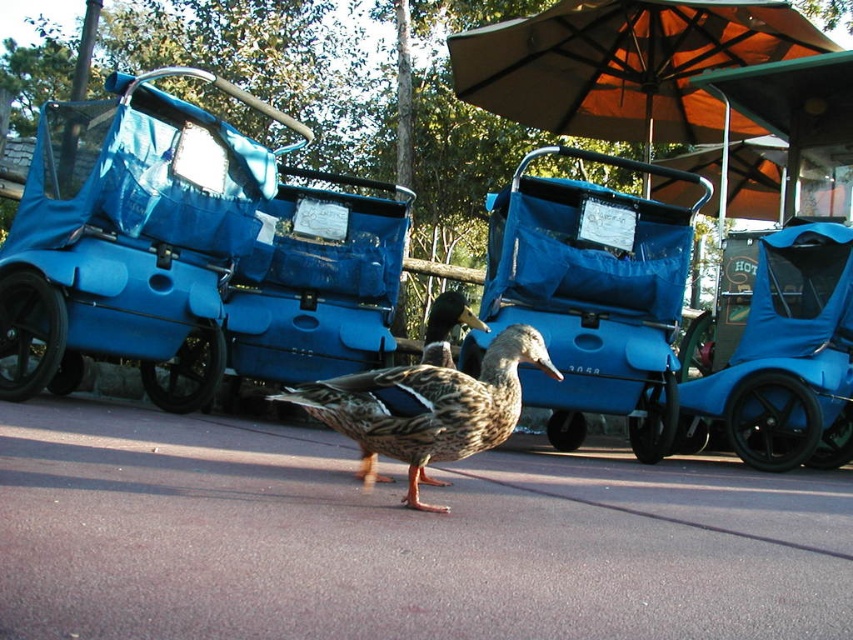
From the picture: You are a photographer trying to capture both the blue matte golf cart at center and the brown fabric umbrella at upper center in a single shot. Which object should you focus on first to ensure both are in frame?

You should focus on the blue matte golf cart at center first because it is closer to the viewer than the brown fabric umbrella at upper center, allowing you to adjust your framing to include both objects.

You are a delivery person with a small box that is 1 meter wide. You need to place it on either the brown asphalt at center or the blue fabric carriage at left. Which surface can accommodate the box without exceeding its width?

The brown asphalt at center has a larger width than the blue fabric carriage at left, so the box can be placed on the brown asphalt at center.